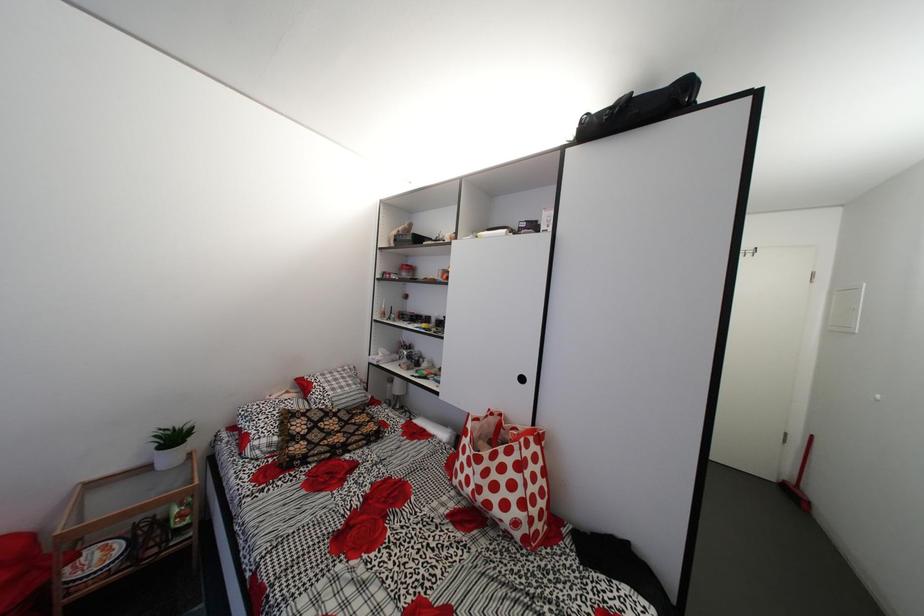
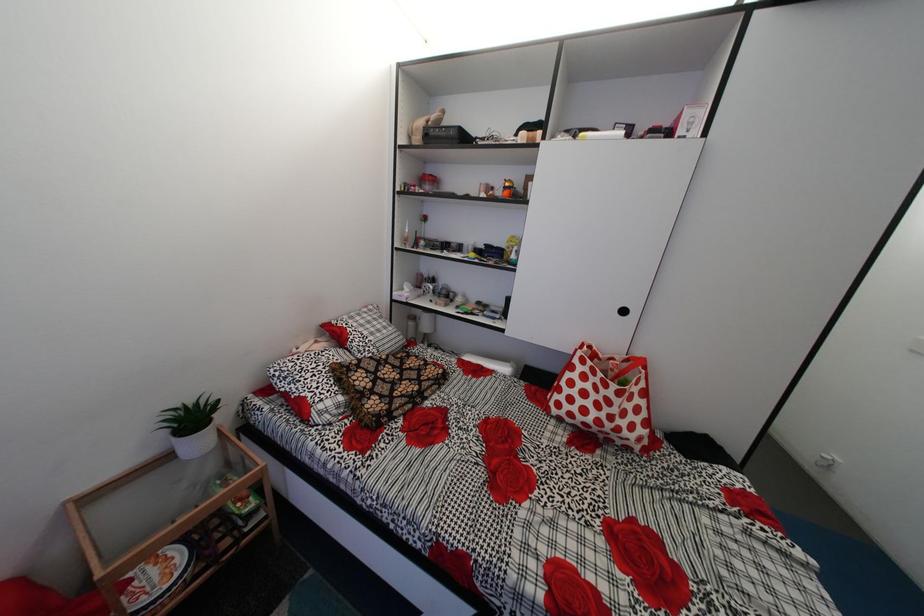
Question: The first image is from the beginning of the video and the second image is from the end. How did the camera likely rotate when shooting the video?

Choices:
 (A) Left
 (B) Right
 (C) Up
 (D) Down

Answer: (D)